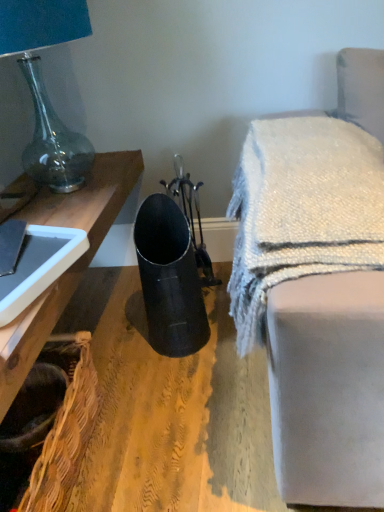
Question: Looking at their shapes, would you say woven brown basket at lower left is wider or thinner than white textured blanket at upper right?

Choices:
 (A) thin
 (B) wide

Answer: (A)

Question: Does point (72, 430) appear closer or farther from the camera than point (284, 271)?

Choices:
 (A) closer
 (B) farther

Answer: (B)

Question: Which of these objects is positioned closest to the teal glass lamp at upper left?

Choices:
 (A) woven brown basket at lower left
 (B) white textured blanket at upper right

Answer: (A)

Question: Which object is the farthest from the teal glass lamp at upper left?

Choices:
 (A) woven brown basket at lower left
 (B) white textured blanket at upper right

Answer: (B)